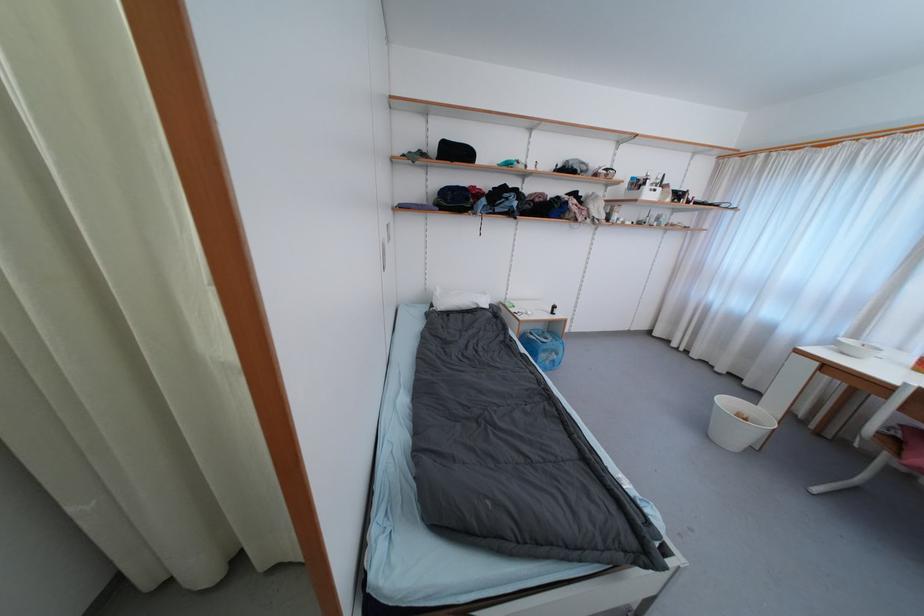
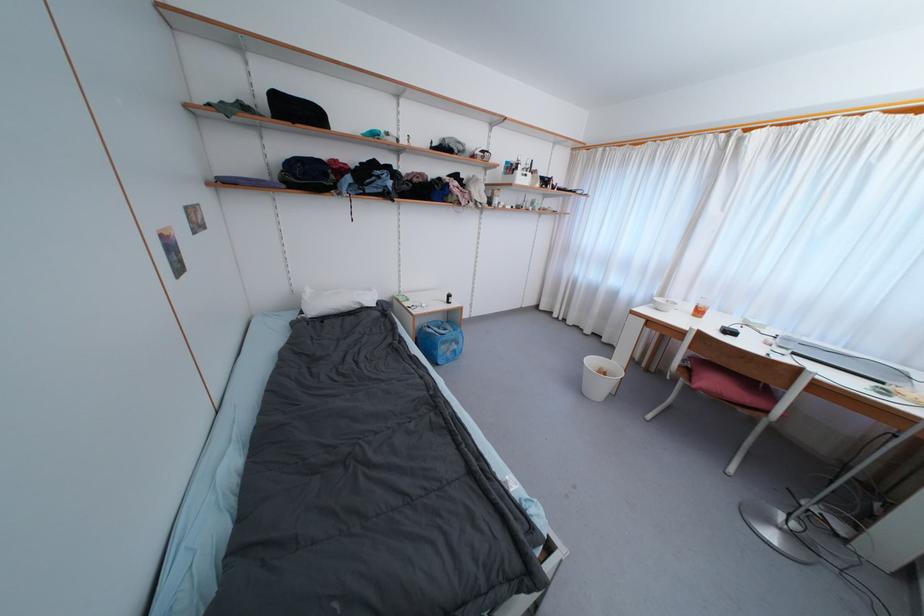
The images are taken continuously from a first-person perspective. In which direction are you moving?

The movement direction of the cameraman is right, forward.